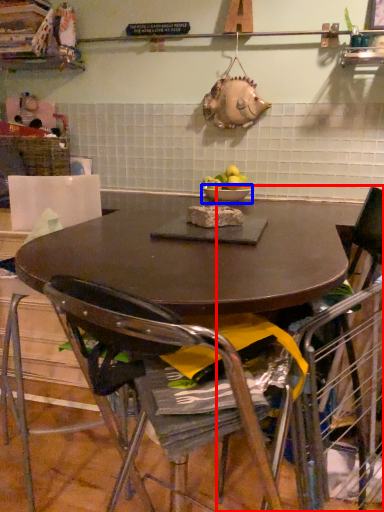
Question: Which of the following is the farthest to the observer, chair (highlighted by a red box) or bowl (highlighted by a blue box)?

Choices:
 (A) chair
 (B) bowl

Answer: (B)